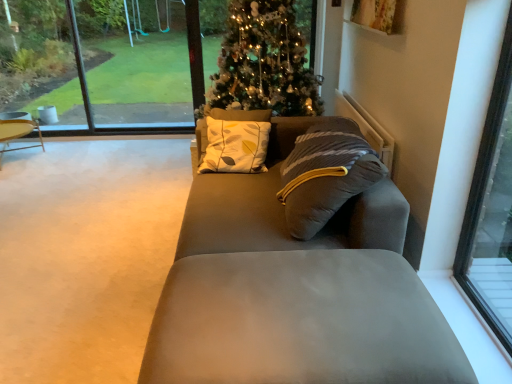
Question: Is wooden round table at left next to transparent glass window at upper left?

Choices:
 (A) yes
 (B) no

Answer: (B)

Question: From a real-world perspective, is wooden round table at left below transparent glass window at upper left?

Choices:
 (A) yes
 (B) no

Answer: (A)

Question: Is wooden round table at left further to camera compared to transparent glass window at upper left?

Choices:
 (A) yes
 (B) no

Answer: (B)

Question: Is wooden round table at left outside transparent glass window at upper left?

Choices:
 (A) no
 (B) yes

Answer: (B)

Question: From a real-world perspective, is wooden round table at left positioned over transparent glass window at upper left based on gravity?

Choices:
 (A) no
 (B) yes

Answer: (A)

Question: Does point (123, 64) appear closer or farther from the camera than point (231, 372)?

Choices:
 (A) closer
 (B) farther

Answer: (B)

Question: Would you say transparent glass window at upper center, the 2th window in the right-to-left sequence, is to the left or to the right of suede-like gray footrest at lower center in the picture?

Choices:
 (A) left
 (B) right

Answer: (A)

Question: Looking at their shapes, would you say transparent glass window at upper center, positioned as the 2th window in front-to-back order, is wider or thinner than suede-like gray footrest at lower center?

Choices:
 (A) thin
 (B) wide

Answer: (A)

Question: Do you think transparent glass window at upper center, positioned as the 2th window in front-to-back order, is within suede-like gray footrest at lower center, or outside of it?

Choices:
 (A) inside
 (B) outside

Answer: (B)

Question: From the image's perspective, is suede gray couch at center positioned above or below wooden round table at left?

Choices:
 (A) below
 (B) above

Answer: (A)

Question: Considering the positions of suede gray couch at center and wooden round table at left in the image, is suede gray couch at center taller or shorter than wooden round table at left?

Choices:
 (A) tall
 (B) short

Answer: (A)

Question: Considering their positions, is suede gray couch at center located in front of or behind wooden round table at left?

Choices:
 (A) behind
 (B) front

Answer: (B)

Question: Considering the positions of suede gray couch at center and wooden round table at left in the image, is suede gray couch at center bigger or smaller than wooden round table at left?

Choices:
 (A) big
 (B) small

Answer: (A)

Question: Which is correct: transparent glass window at right, positioned as the first window in bottom-to-top order, is inside suede gray couch at center, or outside of it?

Choices:
 (A) outside
 (B) inside

Answer: (A)

Question: Looking at the image, does transparent glass window at right, the 2th window when ordered from top to bottom, seem bigger or smaller compared to suede gray couch at center?

Choices:
 (A) small
 (B) big

Answer: (A)